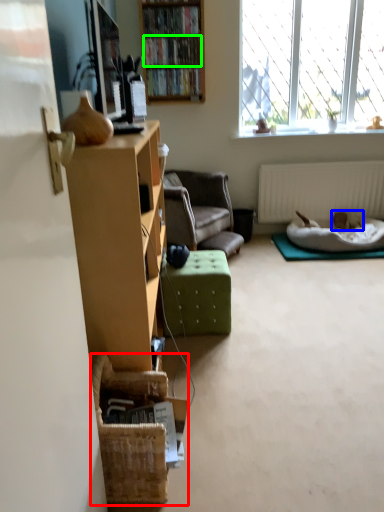
Question: Based on their relative distances, which object is farther from basket (highlighted by a red box)? Choose from animal (highlighted by a blue box) and book (highlighted by a green box).

Choices:
 (A) animal
 (B) book

Answer: (B)